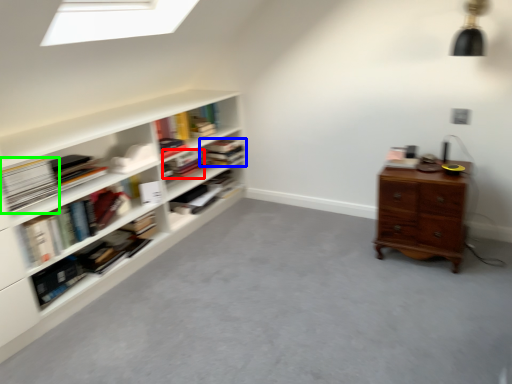
Question: Considering the real-world distances, which object is closest to book (highlighted by a red box)? book (highlighted by a blue box) or paperback book (highlighted by a green box).

Choices:
 (A) book
 (B) paperback book

Answer: (A)